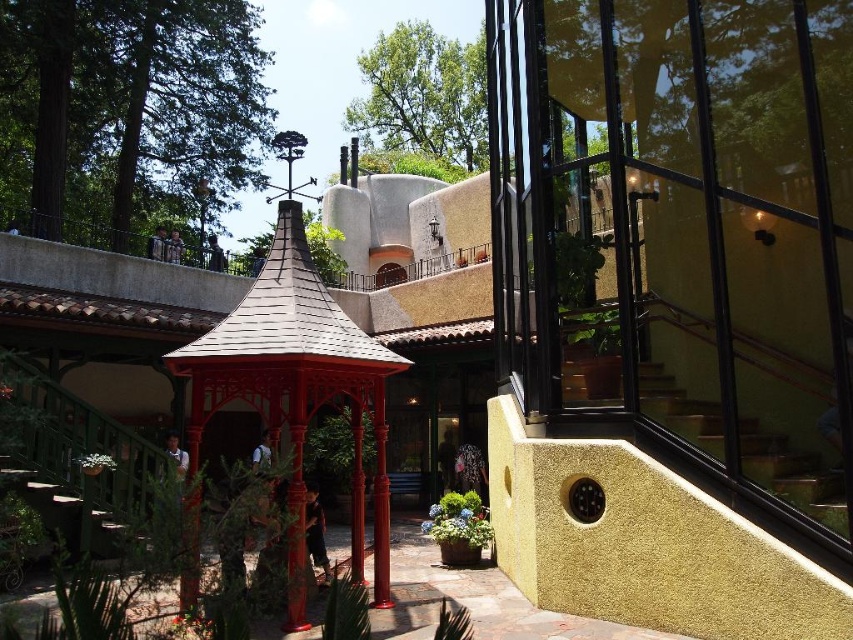
Question: Is matte red gazebo at center to the left of green leafy tree at upper center from the viewer's perspective?

Choices:
 (A) no
 (B) yes

Answer: (B)

Question: Can you confirm if matte red gazebo at center is positioned to the right of green leafy tree at upper center?

Choices:
 (A) yes
 (B) no

Answer: (B)

Question: Does matte red gazebo at center appear on the right side of green leafy tree at upper center?

Choices:
 (A) yes
 (B) no

Answer: (B)

Question: Which point is farther to the camera?

Choices:
 (A) (7, 1)
 (B) (444, 88)
 (C) (279, 388)

Answer: (B)

Question: Which point is farther to the camera?

Choices:
 (A) (457, 61)
 (B) (241, 337)

Answer: (A)

Question: Among these points, which one is farthest from the camera?

Choices:
 (A) (444, 97)
 (B) (136, 160)

Answer: (A)